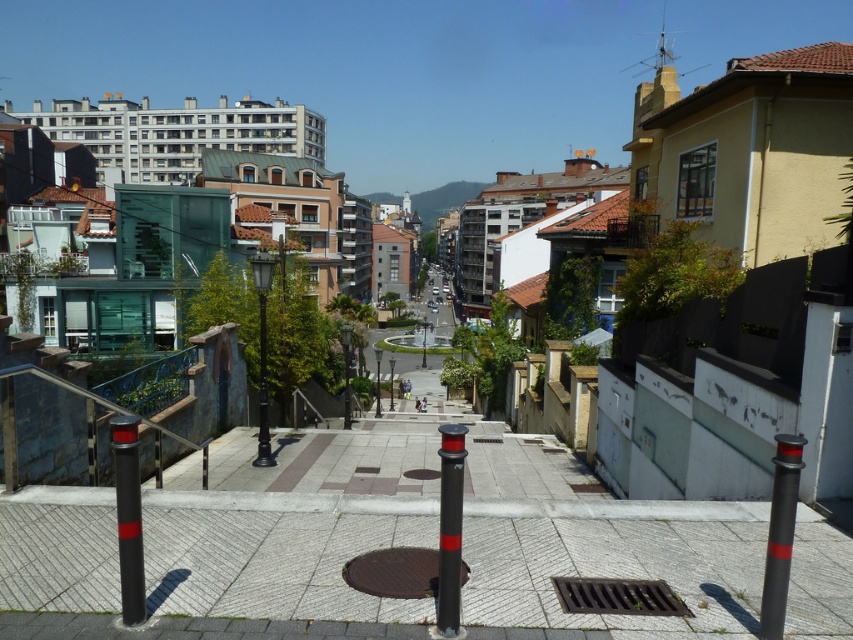
Question: Does black rubber pole at center have a larger size compared to black metal pole at center?

Choices:
 (A) no
 (B) yes

Answer: (A)

Question: Where is smooth concrete pavement at center located in relation to black metal pole at center in the image?

Choices:
 (A) right
 (B) left

Answer: (A)

Question: Can you confirm if smooth concrete pavement at center is smaller than black polished pole at center?

Choices:
 (A) yes
 (B) no

Answer: (B)

Question: Which point is farther to the camera?

Choices:
 (A) black rubber pole at lower left
 (B) black metal pole at center
 (C) black polished pole at center

Answer: (B)

Question: Among these objects, which one is farthest from the camera?

Choices:
 (A) black rubber pole at center
 (B) black rubber pole at lower left
 (C) black rubber pole at lower right

Answer: (A)

Question: Based on their relative distances, which object is nearer to the black rubber pole at center?

Choices:
 (A) black rubber pole at lower left
 (B) smooth concrete pavement at center
 (C) black rubber pole at lower right
 (D) black polished pole at center

Answer: (B)